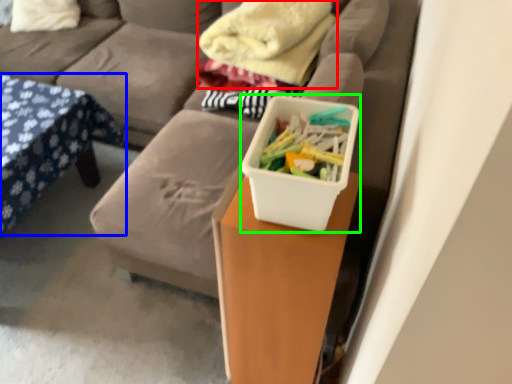
Question: Which object is positioned farthest from blanket (highlighted by a red box)? Select from furniture (highlighted by a blue box) and storage box (highlighted by a green box).

Choices:
 (A) furniture
 (B) storage box

Answer: (B)